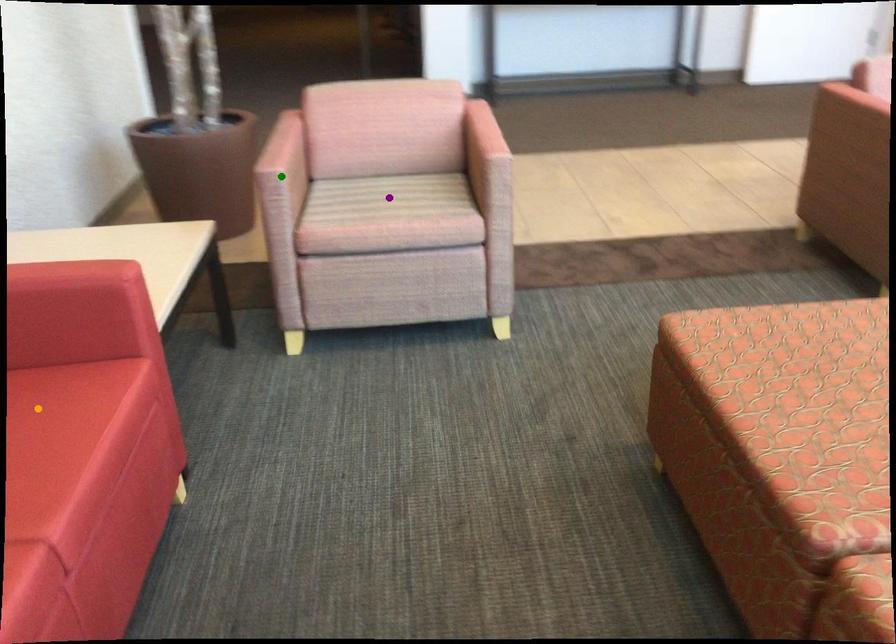
Order these from farthest to nearest:
A) green point
B) orange point
C) purple point

purple point, green point, orange point